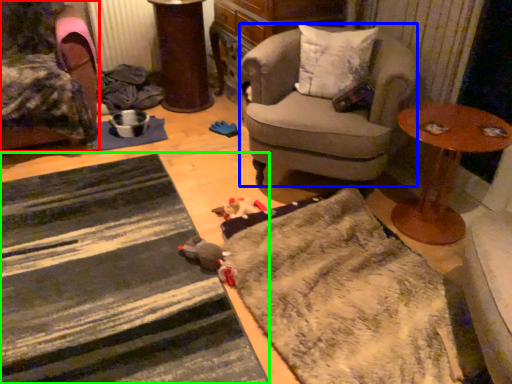
Question: Based on their relative distances, which object is nearer to chair (highlighted by a red box)? Choose from chair (highlighted by a blue box) and doormat (highlighted by a green box).

Choices:
 (A) chair
 (B) doormat

Answer: (B)